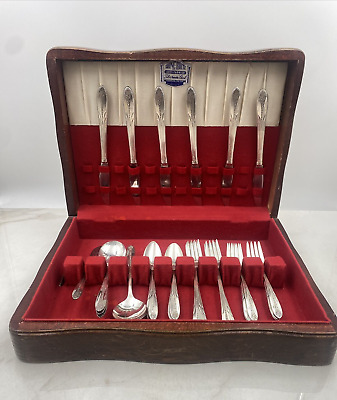
Where is `spoons`? The image size is (337, 400). spoons is located at coordinates (92, 251), (104, 250), (126, 301), (147, 252), (175, 252).